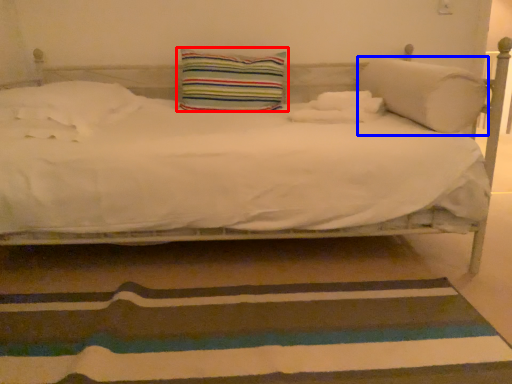
Question: Among these objects, which one is nearest to the camera, pillow (highlighted by a red box) or pillow (highlighted by a blue box)?

Choices:
 (A) pillow
 (B) pillow

Answer: (B)